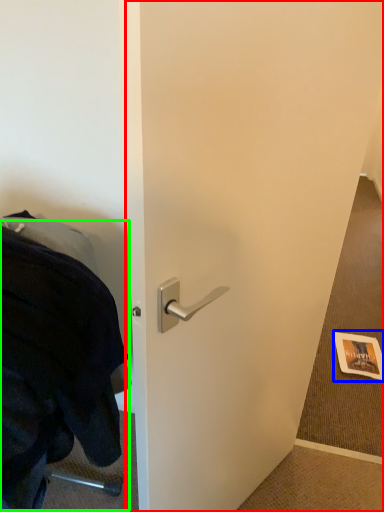
Question: Which object is the farthest from door (highlighted by a red box)? Choose among these: postcard (highlighted by a blue box) or blanket (highlighted by a green box).

Choices:
 (A) postcard
 (B) blanket

Answer: (A)